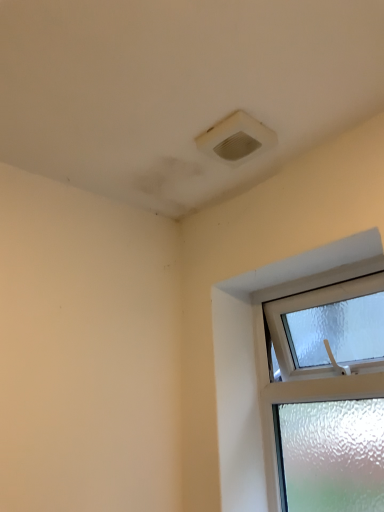
Question: Are clear glass window at upper right and white plastic air conditioning at upper center making contact?

Choices:
 (A) no
 (B) yes

Answer: (A)

Question: Considering the relative positions of clear glass window at upper right and white plastic air conditioning at upper center in the image provided, is clear glass window at upper right to the right of white plastic air conditioning at upper center from the viewer's perspective?

Choices:
 (A) no
 (B) yes

Answer: (B)

Question: Is clear glass window at upper right shorter than white plastic air conditioning at upper center?

Choices:
 (A) yes
 (B) no

Answer: (B)

Question: From a real-world perspective, is clear glass window at upper right below white plastic air conditioning at upper center?

Choices:
 (A) yes
 (B) no

Answer: (A)

Question: Are clear glass window at upper right and white plastic air conditioning at upper center located far from each other?

Choices:
 (A) yes
 (B) no

Answer: (B)

Question: Does clear glass window at upper right lie in front of white plastic air conditioning at upper center?

Choices:
 (A) yes
 (B) no

Answer: (A)

Question: Is the position of white plastic air conditioning at upper center less distant than that of clear glass window at upper right?

Choices:
 (A) no
 (B) yes

Answer: (A)

Question: Does white plastic air conditioning at upper center have a greater width compared to clear glass window at upper right?

Choices:
 (A) no
 (B) yes

Answer: (B)

Question: Considering the relative sizes of white plastic air conditioning at upper center and clear glass window at upper right in the image provided, is white plastic air conditioning at upper center bigger than clear glass window at upper right?

Choices:
 (A) yes
 (B) no

Answer: (B)

Question: Is white plastic air conditioning at upper center smaller than clear glass window at upper right?

Choices:
 (A) yes
 (B) no

Answer: (A)

Question: Is white plastic air conditioning at upper center positioned beyond the bounds of clear glass window at upper right?

Choices:
 (A) no
 (B) yes

Answer: (B)

Question: Can you confirm if white plastic air conditioning at upper center is shorter than clear glass window at upper right?

Choices:
 (A) yes
 (B) no

Answer: (A)

Question: From the image's perspective, is white plastic air conditioning at upper center located above or below clear glass window at upper right?

Choices:
 (A) below
 (B) above

Answer: (B)